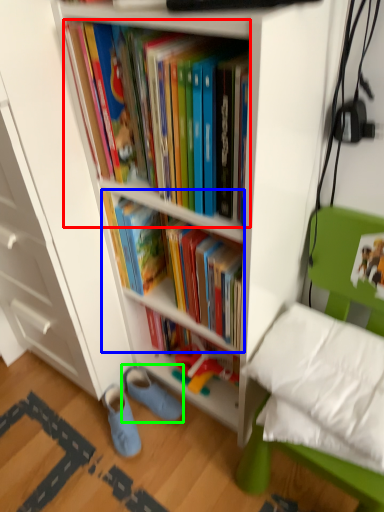
Question: Which is nearer to the book (highlighted by a red box)? book (highlighted by a blue box) or footwear (highlighted by a green box).

Choices:
 (A) book
 (B) footwear

Answer: (A)